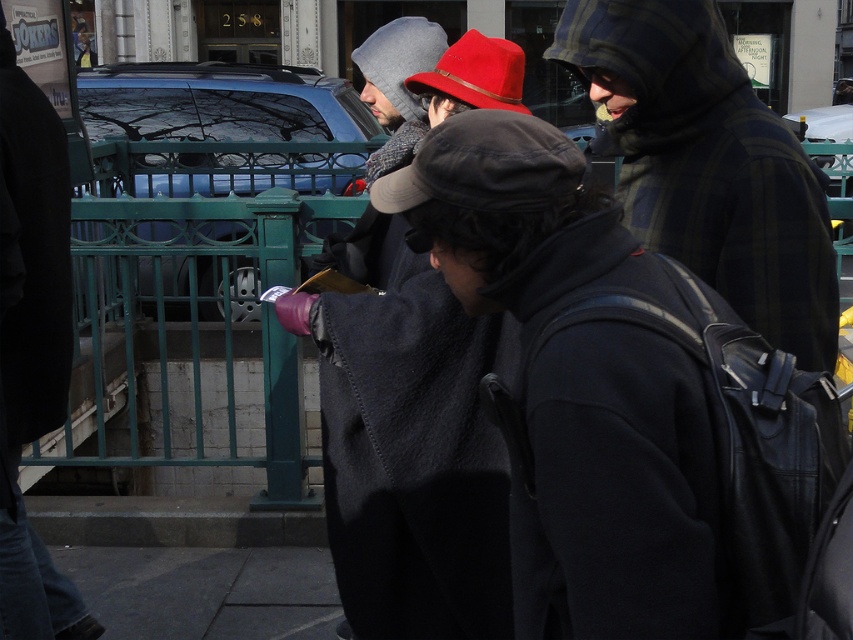
Does red felt hat at center have a greater height compared to matte black coat at center?

No.

Can you confirm if red felt hat at center is positioned to the right of matte black coat at center?

Indeed, red felt hat at center is positioned on the right side of matte black coat at center.

At what (x,y) coordinates should I click in order to perform the action: click on red felt hat at center. Please return your answer as a coordinate pair (x, y). Image resolution: width=853 pixels, height=640 pixels. Looking at the image, I should click on (405, 442).

Locate an element on the screen. The width and height of the screenshot is (853, 640). red felt hat at center is located at coordinates (405, 442).

Is point (36, 541) positioned before point (320, 605)?

That is True.

Who is positioned more to the left, matte black coat at center or dark gray concrete pavement at lower center?

Positioned to the left is matte black coat at center.

Is point (62, 243) positioned in front of point (323, 556)?

Yes, it is in front of point (323, 556).

The width and height of the screenshot is (853, 640). What are the coordinates of `matte black coat at center` in the screenshot? It's located at (32, 342).

Between point (737, 250) and point (26, 182), which one is positioned in front?

Point (737, 250) is more forward.

Does plaid woolen jacket at center appear over matte black coat at center?

Yes.

Find the location of a particular element. plaid woolen jacket at center is located at coordinates (711, 166).